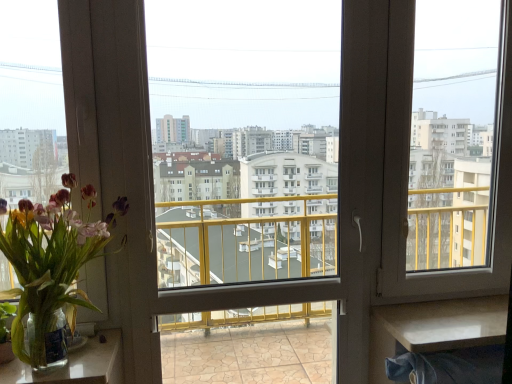
Question: Can you confirm if translucent glass vase at left is thinner than clear glass vase at lower left, which is the second table from right to left?

Choices:
 (A) no
 (B) yes

Answer: (A)

Question: Are translucent glass vase at left and clear glass vase at lower left, which is the second table from right to left, beside each other?

Choices:
 (A) yes
 (B) no

Answer: (B)

Question: Can you confirm if translucent glass vase at left is positioned to the left of clear glass vase at lower left, which is the second table from right to left?

Choices:
 (A) no
 (B) yes

Answer: (A)

Question: Does translucent glass vase at left have a smaller size compared to clear glass vase at lower left, which is the second table from right to left?

Choices:
 (A) yes
 (B) no

Answer: (B)

Question: From a real-world perspective, is translucent glass vase at left positioned under clear glass vase at lower left, which is the second table from right to left, based on gravity?

Choices:
 (A) yes
 (B) no

Answer: (B)

Question: Is transparent plastic window screen at center, marked as the second window screen in a right-to-left arrangement, taller or shorter than clear glass vase at lower left, arranged as the first table when viewed from the left?

Choices:
 (A) tall
 (B) short

Answer: (A)

Question: From a real-world perspective, relative to clear glass vase at lower left, which is the second table from right to left, is transparent plastic window screen at center, which is the first window screen in left-to-right order, vertically above or below?

Choices:
 (A) above
 (B) below

Answer: (A)

Question: In the image, is transparent plastic window screen at center, marked as the second window screen in a right-to-left arrangement, positioned in front of or behind clear glass vase at lower left, arranged as the first table when viewed from the left?

Choices:
 (A) behind
 (B) front

Answer: (A)

Question: Looking at their shapes, would you say transparent plastic window screen at center, marked as the second window screen in a right-to-left arrangement, is wider or thinner than clear glass vase at lower left, arranged as the first table when viewed from the left?

Choices:
 (A) thin
 (B) wide

Answer: (A)

Question: Based on their positions, is translucent glass vase at left located to the left or right of clear glass vase at lower left, arranged as the first table when viewed from the left?

Choices:
 (A) left
 (B) right

Answer: (B)

Question: Considering the positions of point pos(58,226) and point pos(62,375), is point pos(58,226) closer or farther from the camera than point pos(62,375)?

Choices:
 (A) farther
 (B) closer

Answer: (B)

Question: Do you think translucent glass vase at left is within clear glass vase at lower left, which is the second table from right to left, or outside of it?

Choices:
 (A) outside
 (B) inside

Answer: (A)

Question: From the image's perspective, is translucent glass vase at left located above or below clear glass vase at lower left, which is the second table from right to left?

Choices:
 (A) above
 (B) below

Answer: (A)

Question: Is clear glass vase at lower left, arranged as the first table when viewed from the left, bigger or smaller than translucent glass vase at left?

Choices:
 (A) small
 (B) big

Answer: (A)

Question: Is clear glass vase at lower left, which is the second table from right to left, spatially inside translucent glass vase at left, or outside of it?

Choices:
 (A) outside
 (B) inside

Answer: (A)